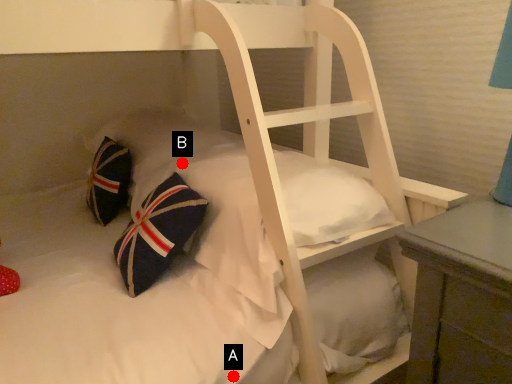
Question: Two points are circled on the image, labeled by A and B beside each circle. Which point is further to the camera?

Choices:
 (A) A is further
 (B) B is further

Answer: (B)